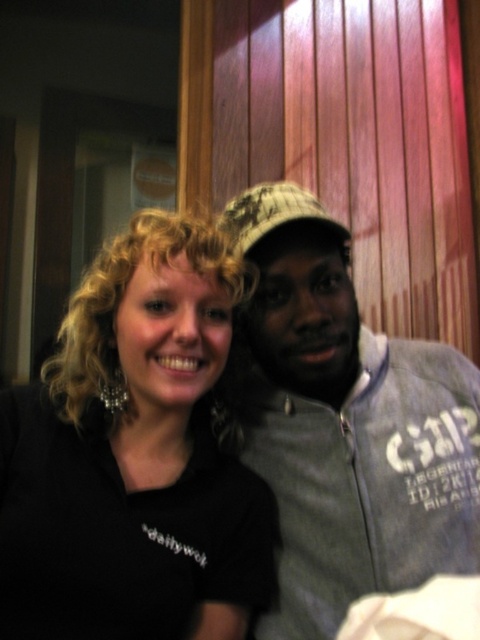
You are standing in the room and want to reach the gray cotton jacket at right. Which direction should you move towards?

You should move towards the right side of the room to reach the gray cotton jacket at right.

You are a photographer adjusting your camera settings to focus on the black matte shirt at center and the gray cotton jacket at right. Which object should you focus on first to ensure both are in sharp focus?

You should focus on the black matte shirt at center first because it is closer to the viewer than the gray cotton jacket at right, so starting with the closer object will help achieve focus on both.